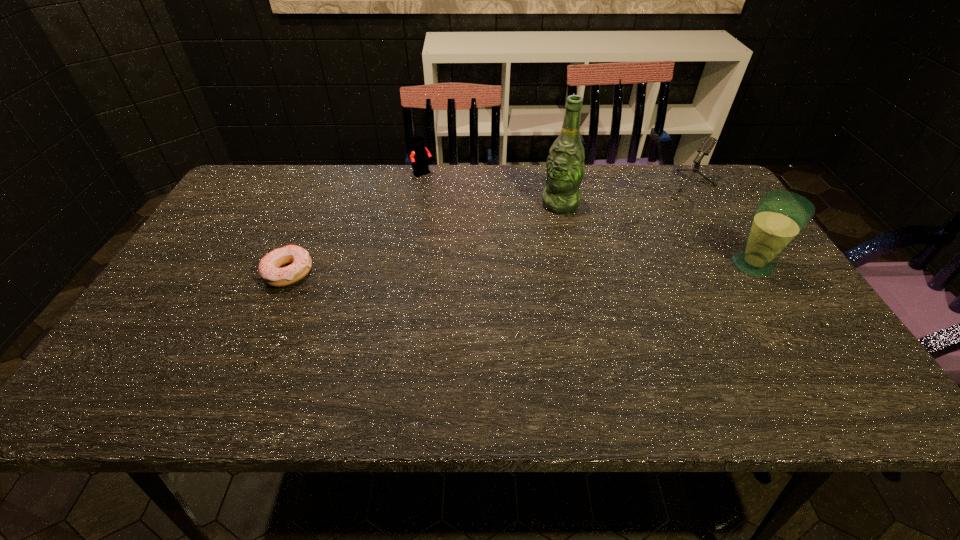
This screenshot has width=960, height=540. Identify the location of blank space at the near right corner. (833, 361).

Locate an element on the screen. empty space between the doughnut and the beer bottle is located at coordinates (425, 238).

Locate an element on the screen. vacant area that lies between the doughnut and the Lego is located at coordinates (357, 224).

Where is `free space that is in between the fourth shortest object and the shortest object`? Image resolution: width=960 pixels, height=540 pixels. free space that is in between the fourth shortest object and the shortest object is located at coordinates (521, 269).

Where is `unoccupied position between the Lego and the doughnut`? unoccupied position between the Lego and the doughnut is located at coordinates (357, 224).

Where is `blank region between the glass and the microphone`? This screenshot has height=540, width=960. blank region between the glass and the microphone is located at coordinates (716, 228).

This screenshot has width=960, height=540. In order to click on vacant area that lies between the tallest object and the Lego in this screenshot , I will do `click(492, 190)`.

I want to click on vacant point located between the fourth object from right to left and the second tallest object, so (x=588, y=220).

Locate an element on the screen. The height and width of the screenshot is (540, 960). unoccupied area between the tallest object and the second tallest object is located at coordinates (x=657, y=234).

Select which object is the second closest to the doughnut. Please provide its 2D coordinates. Your answer should be formatted as a tuple, i.e. [(x, y)], where the tuple contains the x and y coordinates of a point satisfying the conditions above.

[(565, 165)]